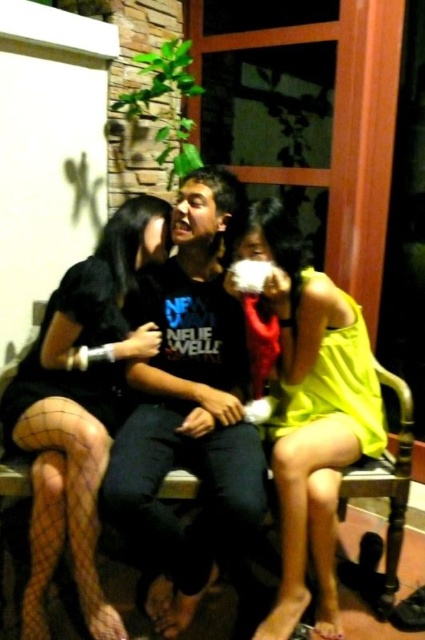
Measure the distance from black matte shirt at center to yellow matte dress at center.

24.78 centimeters

Is black matte shirt at center to the right of yellow matte dress at center from the viewer's perspective?

No, black matte shirt at center is not to the right of yellow matte dress at center.

Measure the distance between point (252, 483) and camera.

5.16 feet

Identify the location of black matte shirt at center. (190, 416).

Does black matte shirt at center appear on the left side of black fishnet stockings at left?

In fact, black matte shirt at center is to the right of black fishnet stockings at left.

Does black matte shirt at center have a lesser width compared to black fishnet stockings at left?

Yes, black matte shirt at center is thinner than black fishnet stockings at left.

Which is behind, point (229, 200) or point (8, 403)?

The point (229, 200) is more distant.

Locate an element on the screen. Image resolution: width=425 pixels, height=640 pixels. black matte shirt at center is located at coordinates (190, 416).

Is black fishnet stockings at left bigger than yellow satin dress at right?

Correct, black fishnet stockings at left is larger in size than yellow satin dress at right.

Can you confirm if black fishnet stockings at left is thinner than yellow satin dress at right?

In fact, black fishnet stockings at left might be wider than yellow satin dress at right.

Who is more distant from viewer, [85,387] or [306,284]?

The point [85,387] is more distant.

This screenshot has width=425, height=640. What are the coordinates of `black fishnet stockings at left` in the screenshot? It's located at pos(81,404).